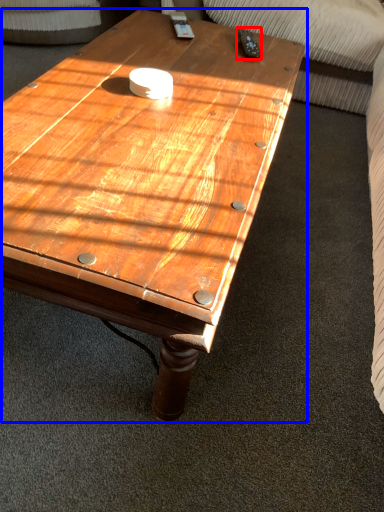
Question: Which object is closer to the camera taking this photo, remote (highlighted by a red box) or coffee table (highlighted by a blue box)?

Choices:
 (A) remote
 (B) coffee table

Answer: (B)